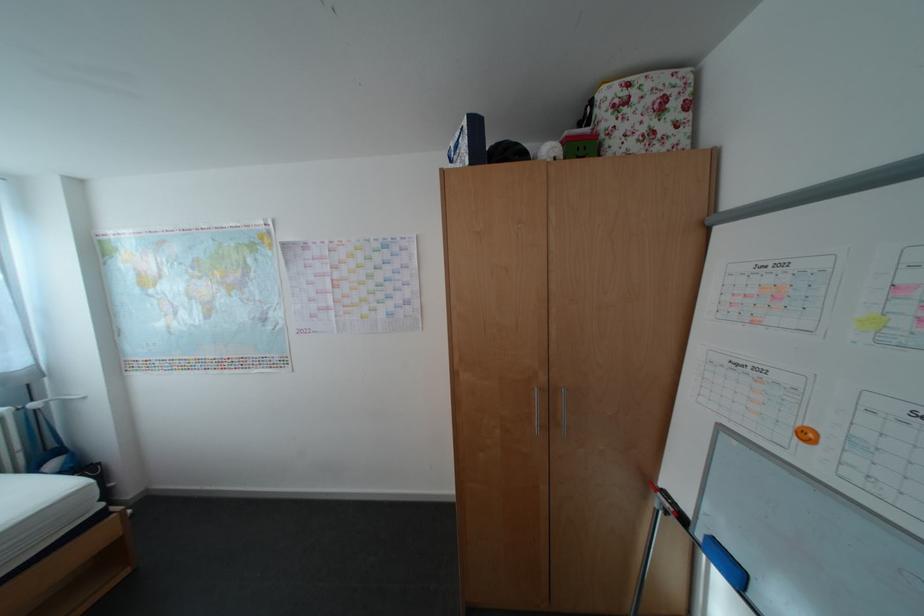
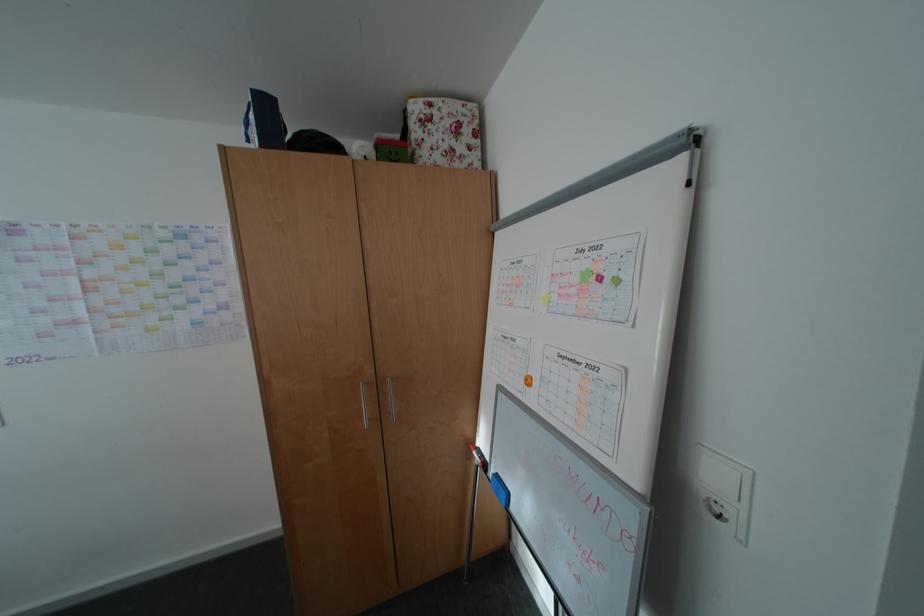
Where in the second image is the point corresponding to (x=811, y=426) from the first image?

(539, 376)